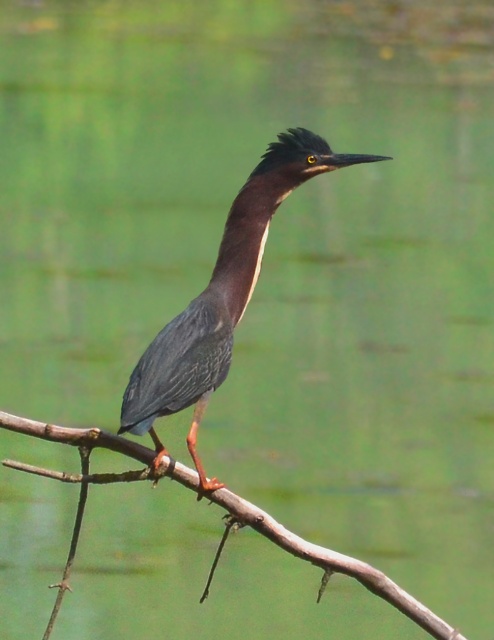
You are a birdwatcher observing a Green Heron perched on a branch. You notice the brown wood tree branch at center and the green glossy neck at center. Which object is positioned to the left when looking at the image?

The brown wood tree branch at center is to the left of the green glossy neck at center.

You are a photographer aiming to capture the Green Heron in the image. You notice two points marked in the scene. One is at point (95, 440) and the other at point (220, 262). Which point is closer to the bird?

Point (95, 440) is in front of point (220, 262), so it is closer to the bird.